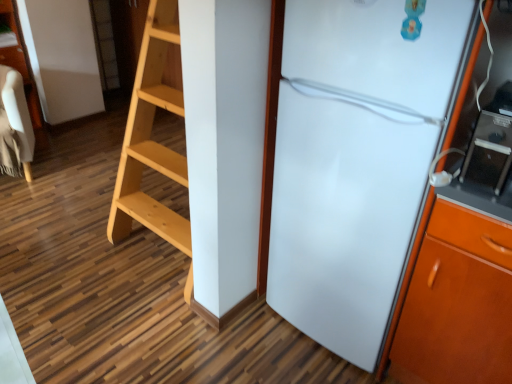
Question: Is the position of white glossy refrigerator at right less distant than that of black glossy microwave at right?

Choices:
 (A) yes
 (B) no

Answer: (A)

Question: Can you confirm if white glossy refrigerator at right is wider than black glossy microwave at right?

Choices:
 (A) no
 (B) yes

Answer: (B)

Question: Does white glossy refrigerator at right appear on the right side of black glossy microwave at right?

Choices:
 (A) no
 (B) yes

Answer: (A)

Question: From a real-world perspective, is white glossy refrigerator at right under black glossy microwave at right?

Choices:
 (A) no
 (B) yes

Answer: (B)

Question: Would you say white glossy refrigerator at right is a long distance from black glossy microwave at right?

Choices:
 (A) yes
 (B) no

Answer: (B)

Question: Does point (482, 150) appear closer or farther from the camera than point (370, 18)?

Choices:
 (A) farther
 (B) closer

Answer: (A)

Question: Considering the positions of black glossy microwave at right and white glossy refrigerator at right in the image, is black glossy microwave at right taller or shorter than white glossy refrigerator at right?

Choices:
 (A) short
 (B) tall

Answer: (A)

Question: Would you say black glossy microwave at right is inside or outside white glossy refrigerator at right?

Choices:
 (A) outside
 (B) inside

Answer: (A)

Question: From the image's perspective, relative to white glossy refrigerator at right, is black glossy microwave at right above or below?

Choices:
 (A) above
 (B) below

Answer: (A)

Question: Is point (12, 170) closer or farther from the camera than point (279, 261)?

Choices:
 (A) farther
 (B) closer

Answer: (A)

Question: Considering the positions of beige fabric chair at left and white glossy refrigerator at right in the image, is beige fabric chair at left wider or thinner than white glossy refrigerator at right?

Choices:
 (A) wide
 (B) thin

Answer: (A)

Question: Choose the correct answer: Is beige fabric chair at left inside white glossy refrigerator at right or outside it?

Choices:
 (A) outside
 (B) inside

Answer: (A)

Question: From a real-world perspective, is beige fabric chair at left physically located above or below white glossy refrigerator at right?

Choices:
 (A) above
 (B) below

Answer: (B)

Question: Is black glossy microwave at right taller or shorter than beige fabric chair at left?

Choices:
 (A) short
 (B) tall

Answer: (A)

Question: From a real-world perspective, is black glossy microwave at right physically located above or below beige fabric chair at left?

Choices:
 (A) below
 (B) above

Answer: (B)